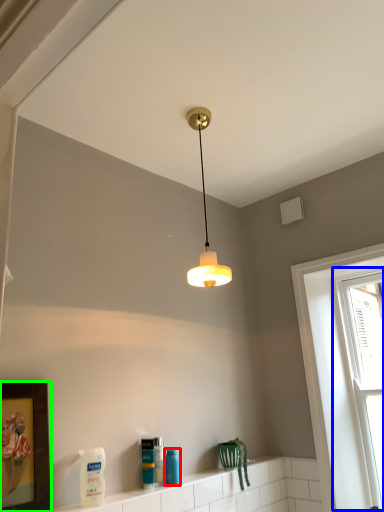
Question: Which object is positioned closest to cleaning product (highlighted by a red box)? Select from window (highlighted by a blue box) and picture frame (highlighted by a green box).

Choices:
 (A) window
 (B) picture frame

Answer: (B)